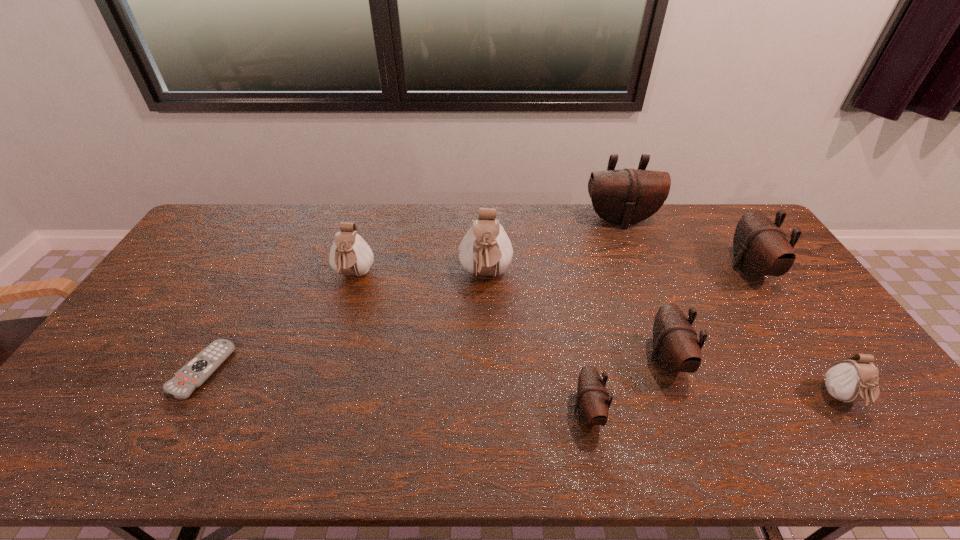
The image size is (960, 540). Find the location of `the nearest white pouch`. the nearest white pouch is located at coordinates (852, 380).

The image size is (960, 540). What are the coordinates of `the fifth pouch from right to left` in the screenshot? It's located at (592, 401).

Where is `the leftmost brown pouch`? the leftmost brown pouch is located at coordinates (592, 401).

Identify the location of remote control. (196, 372).

This screenshot has width=960, height=540. What are the coordinates of `the leftmost object` in the screenshot? It's located at (196, 372).

I want to click on vacant region located 0.170m with the flap open on the farthest brown pouch, so pyautogui.click(x=636, y=262).

Image resolution: width=960 pixels, height=540 pixels. What are the coordinates of `vacant space located 0.380m on the front-facing side of the biggest white pouch` in the screenshot? It's located at (488, 409).

At what (x,y) coordinates should I click in order to perform the action: click on vacant space situated with the flap open on the third smallest brown pouch. Please return your answer as a coordinate pair (x, y). The width and height of the screenshot is (960, 540). Looking at the image, I should click on (619, 269).

Locate an element on the screen. The image size is (960, 540). free space located 0.170m with the flap open on the third smallest brown pouch is located at coordinates (680, 269).

Where is `free location located 0.070m with the flap open on the third smallest brown pouch`? The image size is (960, 540). free location located 0.070m with the flap open on the third smallest brown pouch is located at coordinates (710, 269).